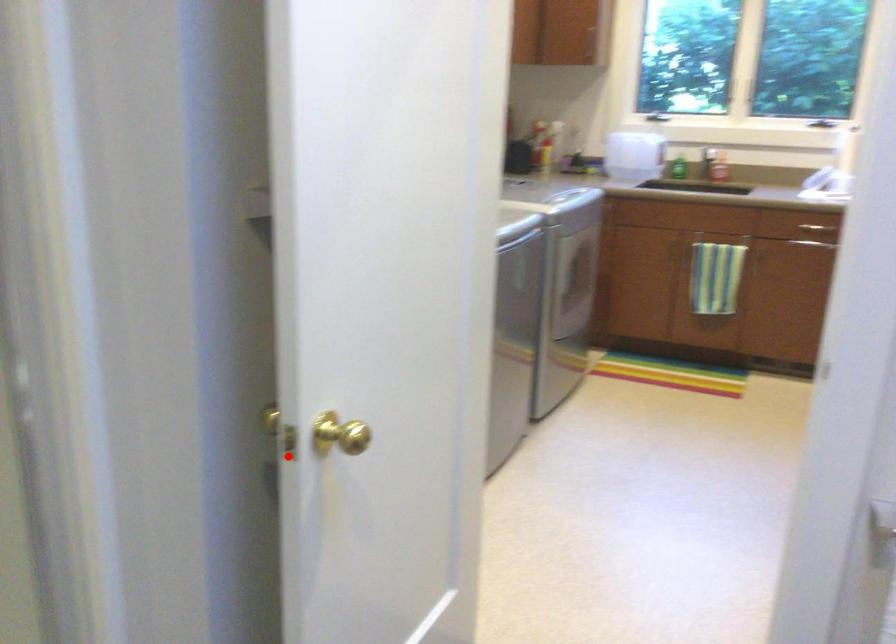
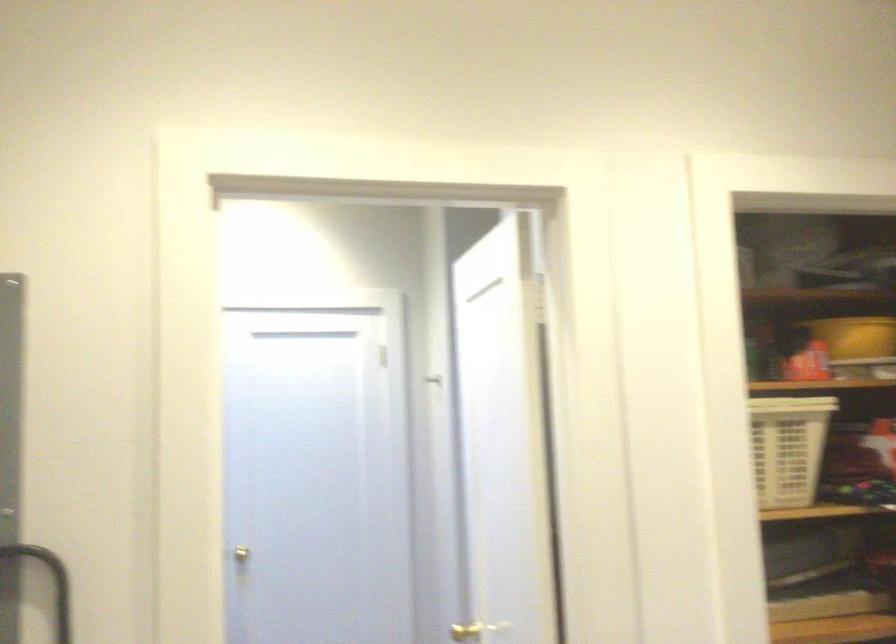
Find the pixel in the second image that matches the highlighted location in the first image.

(464, 632)